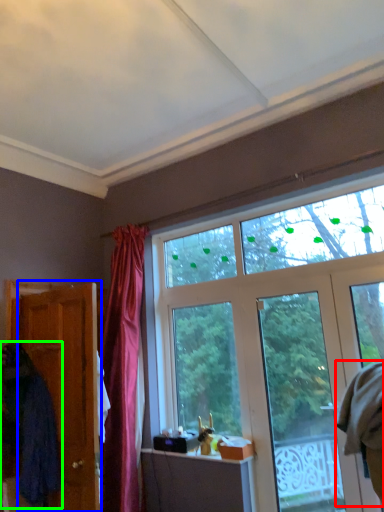
Question: Which object is the farthest from robe (highlighted by a red box)? Choose among these: door (highlighted by a blue box) or robe (highlighted by a green box).

Choices:
 (A) door
 (B) robe

Answer: (B)